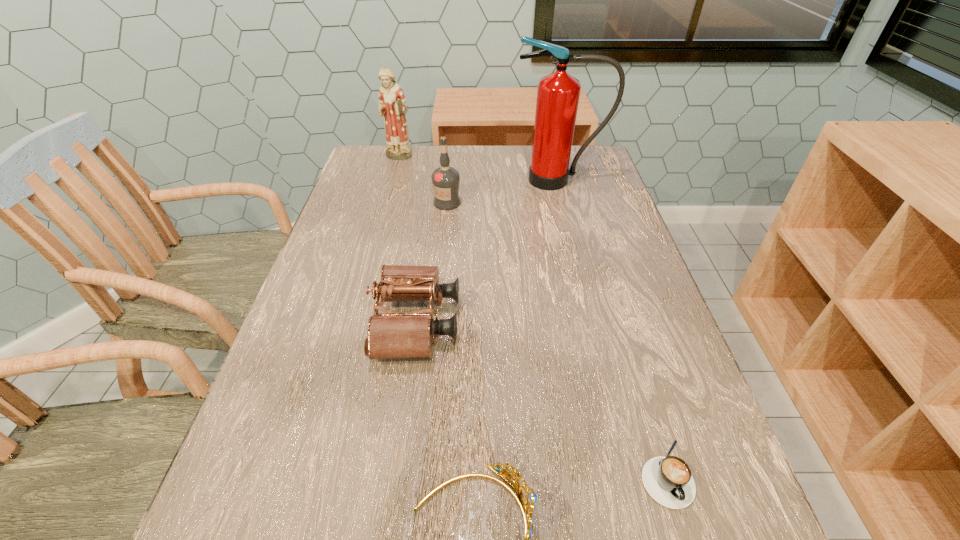
Image resolution: width=960 pixels, height=540 pixels. I want to click on vacant region at the left edge of the desktop, so click(x=349, y=378).

Image resolution: width=960 pixels, height=540 pixels. In order to click on vacant space at the right edge in this screenshot , I will do `click(645, 459)`.

Where is `vacant space at the far left corner of the desktop`? The height and width of the screenshot is (540, 960). vacant space at the far left corner of the desktop is located at coordinates (413, 150).

Locate an element on the screen. vacant space at the far right corner is located at coordinates (589, 145).

This screenshot has width=960, height=540. I want to click on vacant area between the cappuccino and the vodka, so [x=556, y=338].

Identify the location of free space between the second tallest object and the shortest object. Image resolution: width=960 pixels, height=540 pixels. (532, 316).

This screenshot has height=540, width=960. Identify the location of free spot between the cappuccino and the second tallest object. (532, 316).

Identify the location of free space between the fire extinguisher and the figurine. (478, 169).

What are the coordinates of `vacant point located between the tallest object and the farthest object` in the screenshot? It's located at (478, 169).

Where is `vacant space in between the fire extinguisher and the figurine`? The height and width of the screenshot is (540, 960). vacant space in between the fire extinguisher and the figurine is located at coordinates (478, 169).